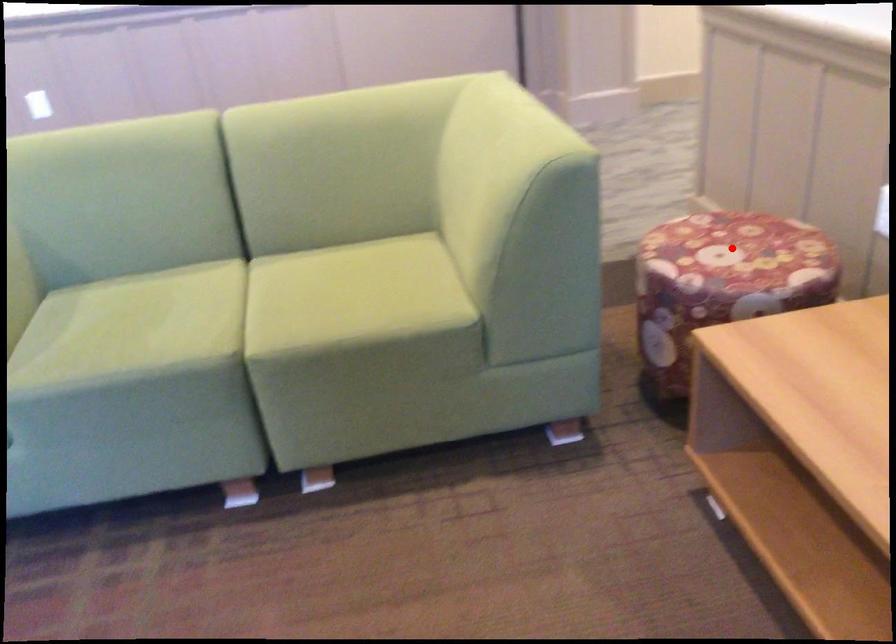
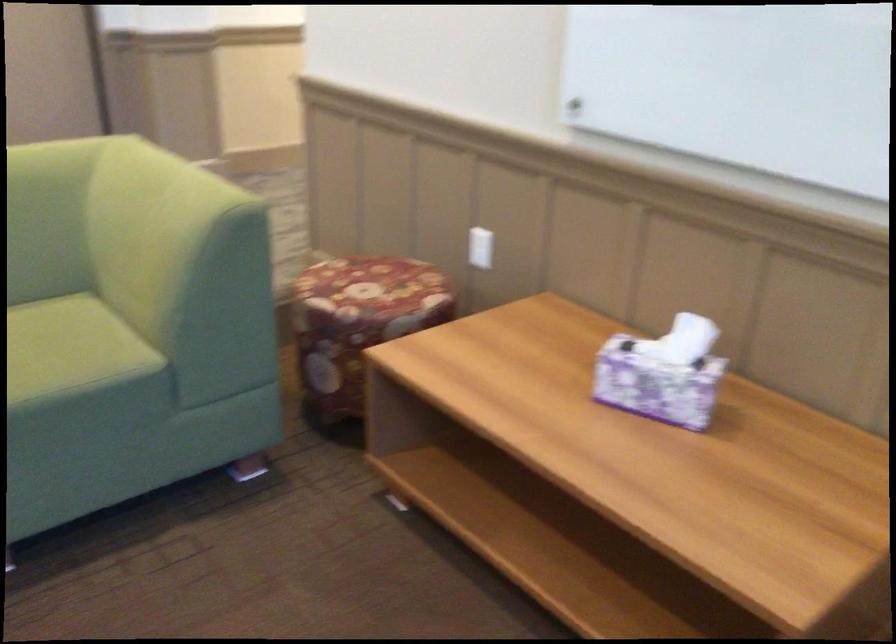
The point at the highlighted location is marked in the first image. Where is the corresponding point in the second image?

(372, 286)